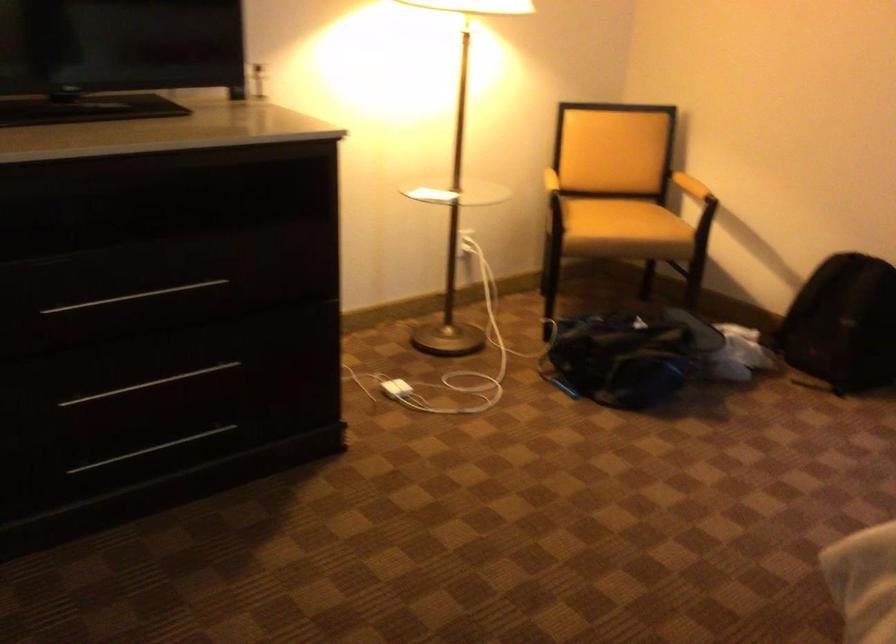
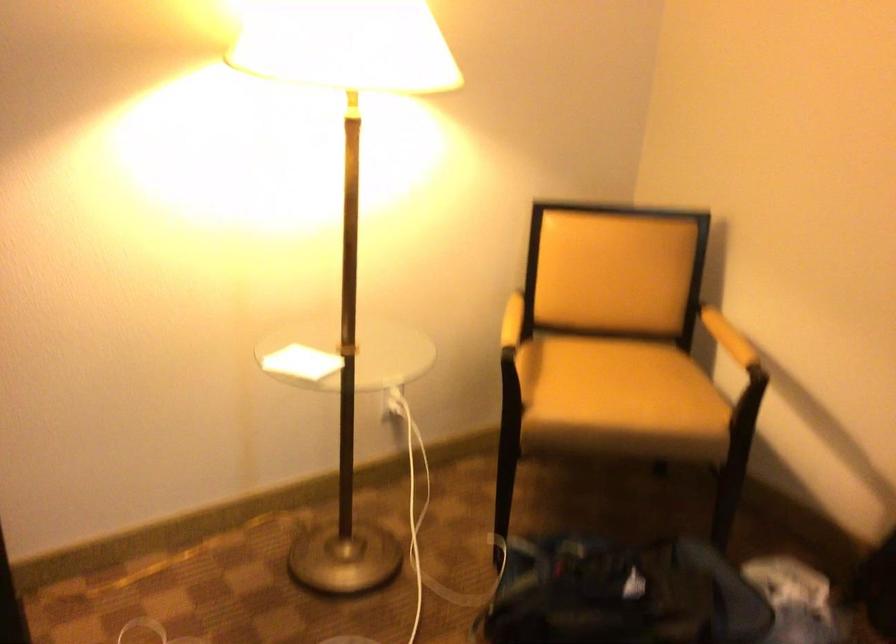
Locate, in the second image, the point that corresponds to (545,175) in the first image.

(512, 321)